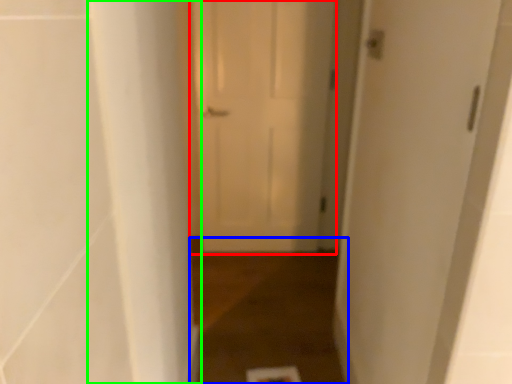
Question: Estimate the real-world distances between objects in this image. Which object is closer to door (highlighted by a red box), path (highlighted by a blue box) or pillar (highlighted by a green box)?

Choices:
 (A) path
 (B) pillar

Answer: (A)